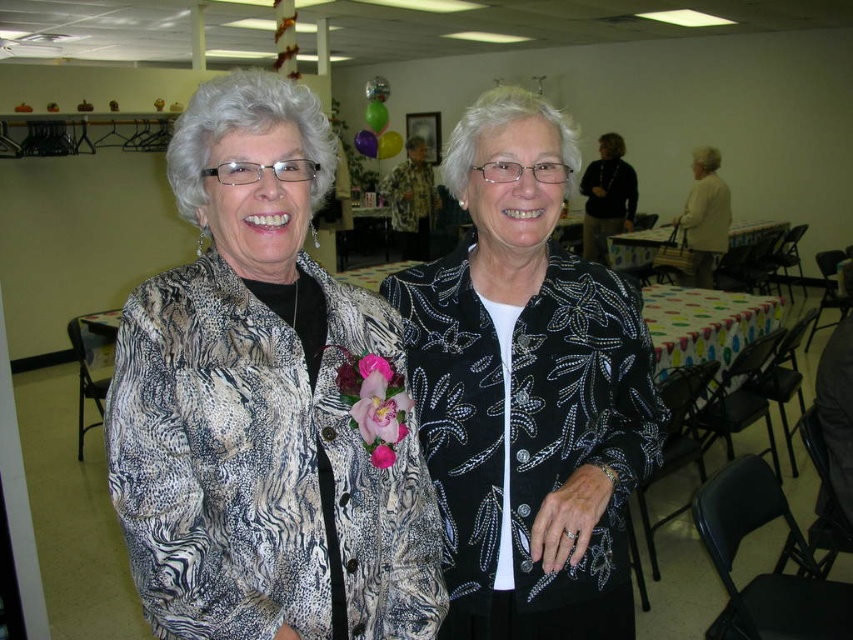
You are standing in the room and want to move from the point at coordinates point (x=213, y=381) to the point at coordinates point (x=474, y=445). Which direction should you move to get closer to your destination?

You should move backward because point (x=213, y=381) is in front of point (x=474, y=445), so moving backward will bring you closer to the destination.

You are a photographer setting up for a group photo. You notice two jackets at the center of the image, a zebra print jacket at center and a black sequined jacket at center. Which jacket would you adjust to the side to ensure both jackets are equally visible in the frame?

The zebra print jacket at center has a lesser width compared to the black sequined jacket at center, so you should adjust the zebra print jacket at center to the side to balance their visibility in the frame.